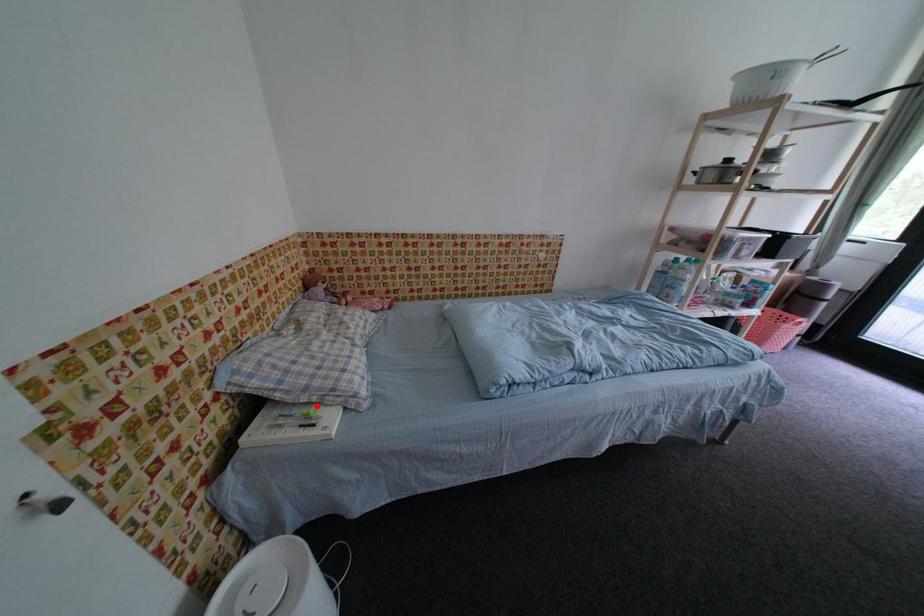
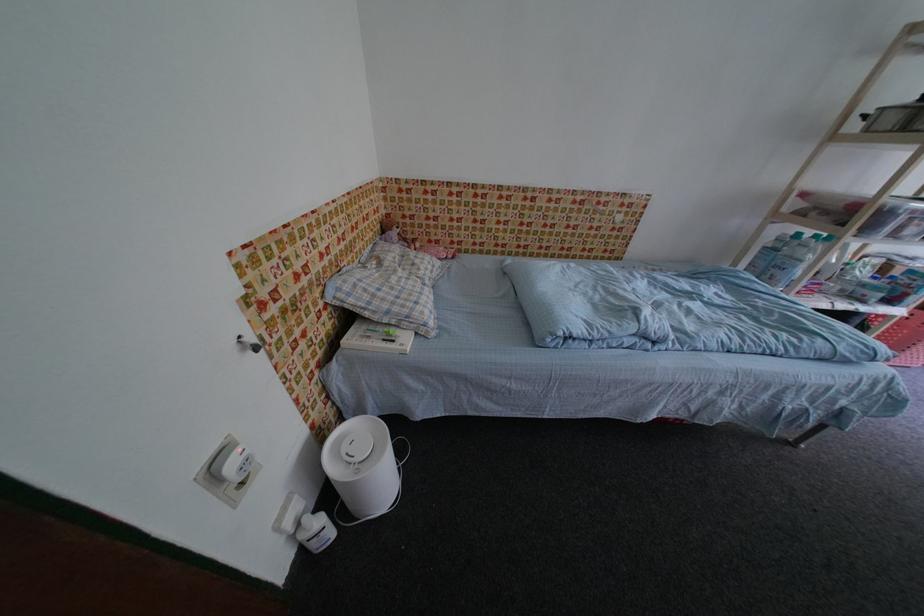
Find the pixel in the second image that matches the highlighted location in the first image.

(396, 328)